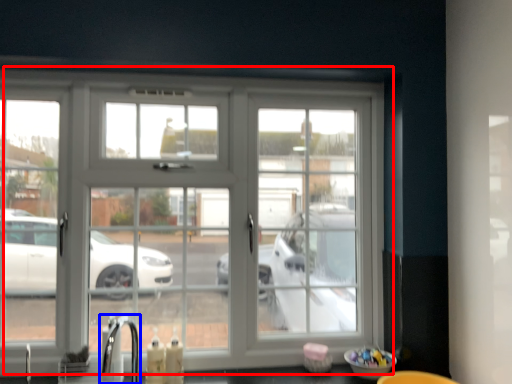
Question: Among these objects, which one is farthest to the camera, window (highlighted by a red box) or faucet (highlighted by a blue box)?

Choices:
 (A) window
 (B) faucet

Answer: (A)